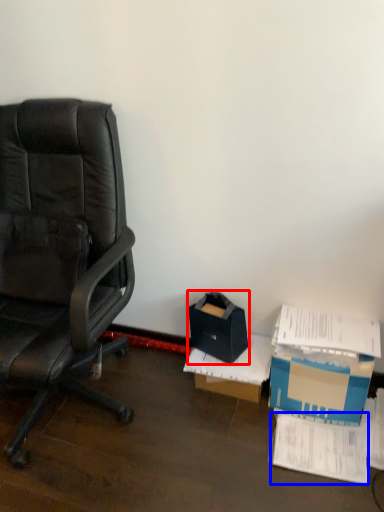
Question: Which object appears closest to the camera in this image, storage box (highlighted by a red box) or paperback book (highlighted by a blue box)?

Choices:
 (A) storage box
 (B) paperback book

Answer: (B)